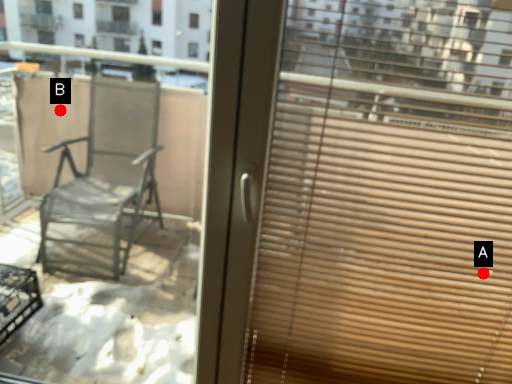
Question: Two points are circled on the image, labeled by A and B beside each circle. Which point is closer to the camera taking this photo?

Choices:
 (A) A is closer
 (B) B is closer

Answer: (A)